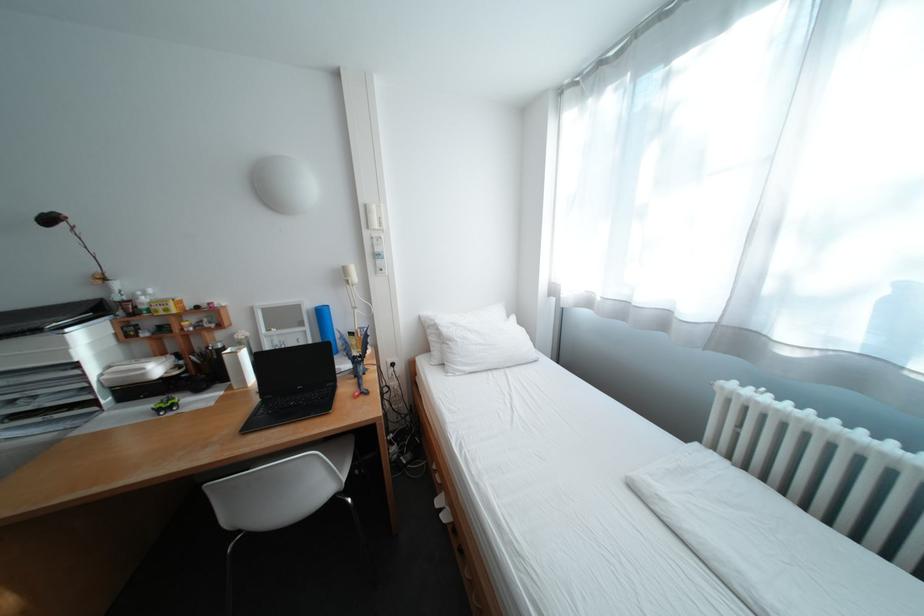
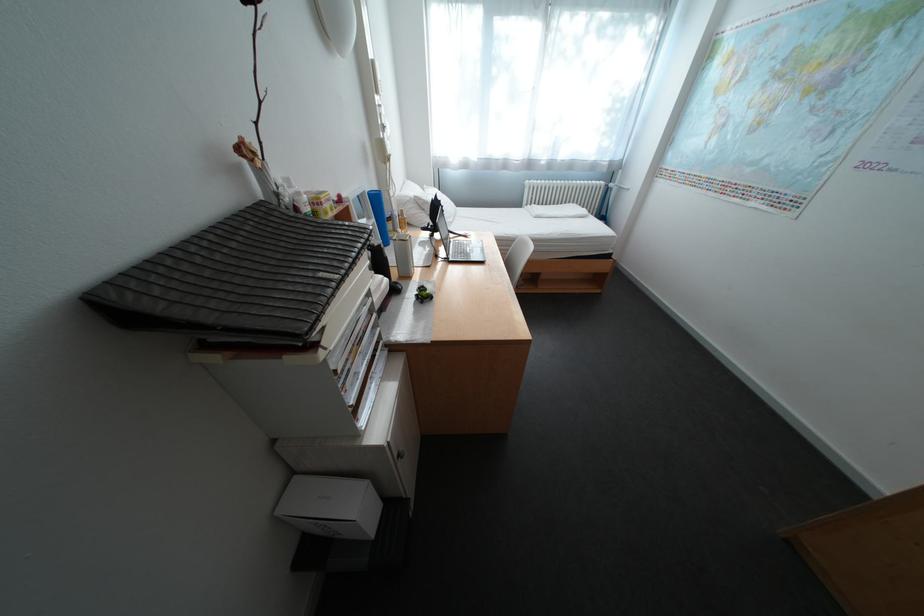
Find the pixel in the second image that matches (141,378) in the first image.

(395, 292)